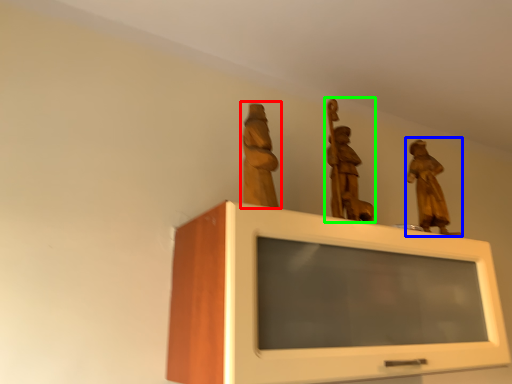
Question: Which is farther away from sculpture (highlighted by a red box)? sculpture (highlighted by a blue box) or sculpture (highlighted by a green box)?

Choices:
 (A) sculpture
 (B) sculpture

Answer: (A)